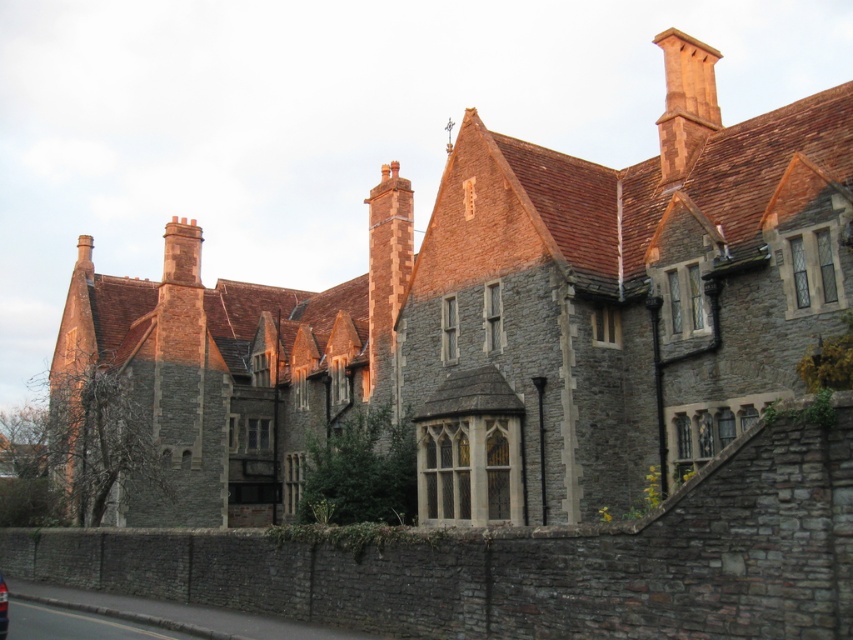
Does smooth terracotta chimney at upper right appear on the left side of matte black car at lower left?

Incorrect, smooth terracotta chimney at upper right is not on the left side of matte black car at lower left.

Which is in front, point (701, 116) or point (0, 605)?

Positioned in front is point (0, 605).

The image size is (853, 640). Find the location of `smooth terracotta chimney at upper right`. smooth terracotta chimney at upper right is located at coordinates (685, 100).

This screenshot has width=853, height=640. What do you see at coordinates (387, 278) in the screenshot?
I see `brick chimney at center` at bounding box center [387, 278].

Who is shorter, brick chimney at center or matte black car at lower left?

matte black car at lower left is shorter.

Which is in front, point (381, 250) or point (0, 584)?

Point (0, 584) is in front.

At what (x,y) coordinates should I click in order to perform the action: click on brick chimney at center. Please return your answer as a coordinate pair (x, y). This screenshot has height=640, width=853. Looking at the image, I should click on (387, 278).

Between brick chimney at center and smooth terracotta chimney at upper right, which one appears on the left side from the viewer's perspective?

Positioned to the left is brick chimney at center.

Describe the element at coordinates (387, 278) in the screenshot. I see `brick chimney at center` at that location.

Locate an element on the screen. brick chimney at center is located at coordinates (387, 278).